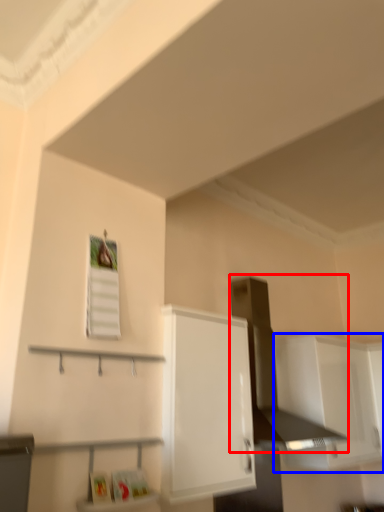
Question: Which object is further to the camera taking this photo, vent (highlighted by a red box) or cabinetry (highlighted by a blue box)?

Choices:
 (A) vent
 (B) cabinetry

Answer: (B)